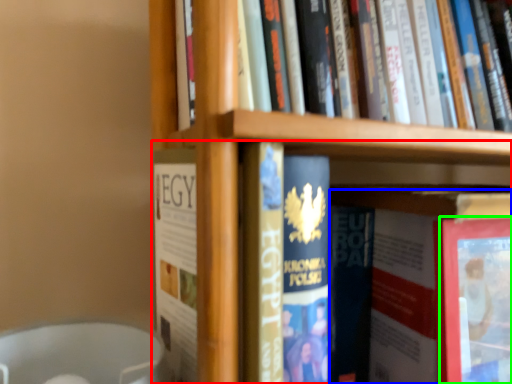
Question: Which object is the farthest from book (highlighted by a red box)? Choose among these: book (highlighted by a blue box) or paperback book (highlighted by a green box).

Choices:
 (A) book
 (B) paperback book

Answer: (B)